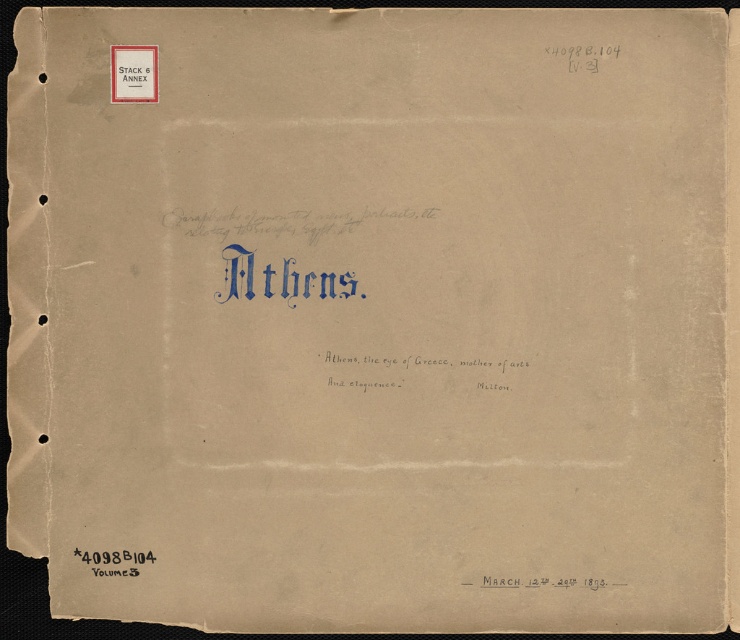
What is the spatial relationship between the black ink writing at center and the matte white sign at upper left?

The black ink writing at center is positioned on the right side of the matte white sign at upper left.